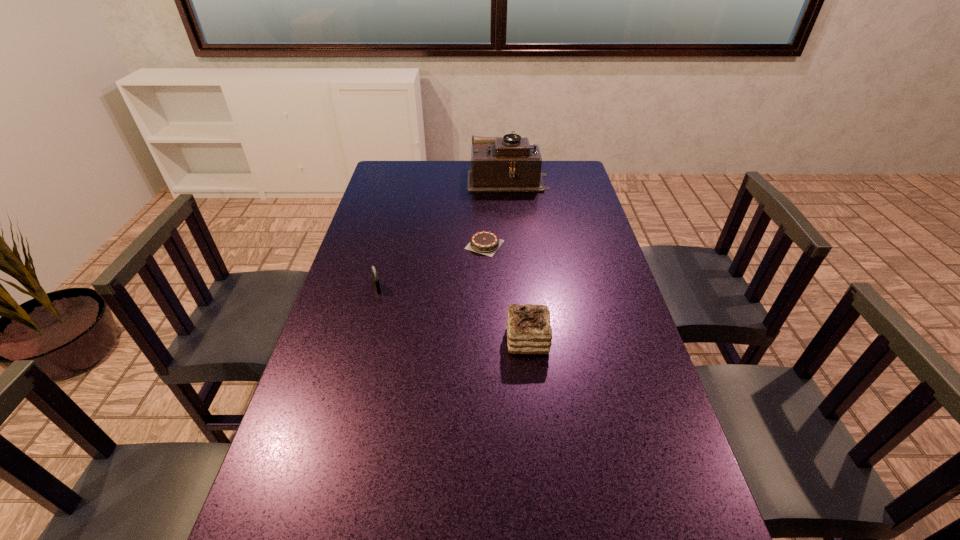
The height and width of the screenshot is (540, 960). Find the location of `vacant space at the far left corner of the desktop`. vacant space at the far left corner of the desktop is located at coordinates (396, 174).

Find the location of `unoccupied position between the tallest object and the farther chocolate cake`. unoccupied position between the tallest object and the farther chocolate cake is located at coordinates (496, 211).

This screenshot has width=960, height=540. Find the location of `unoccupied position between the tallest object and the shortest object`. unoccupied position between the tallest object and the shortest object is located at coordinates (496, 211).

Find the location of a particular element. The width and height of the screenshot is (960, 540). empty location between the shortest object and the farthest object is located at coordinates (496, 211).

Find the location of a particular element. This screenshot has height=540, width=960. empty space between the third farthest object and the shortest object is located at coordinates (431, 266).

Where is `free space that is in between the second shortest object and the phonograph_record`? free space that is in between the second shortest object and the phonograph_record is located at coordinates (443, 233).

Identify the location of unoccupied position between the third farthest object and the tallest object. pos(443,233).

Image resolution: width=960 pixels, height=540 pixels. What are the coordinates of `vacant area between the phonograph_record and the third shortest object` in the screenshot? It's located at (517, 259).

At what (x,y) coordinates should I click in order to perform the action: click on unoccupied position between the nearest object and the shortest object. Please return your answer as a coordinate pair (x, y). The image size is (960, 540). Looking at the image, I should click on (506, 292).

I want to click on free space between the second farthest object and the leftmost object, so click(x=431, y=266).